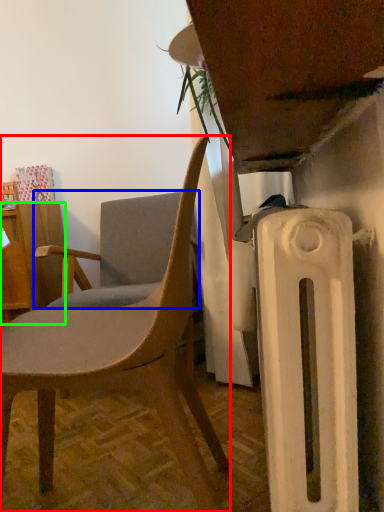
Question: Which object is the closest to the chair (highlighted by a red box)? Choose among these: chair (highlighted by a blue box) or desk (highlighted by a green box).

Choices:
 (A) chair
 (B) desk

Answer: (A)